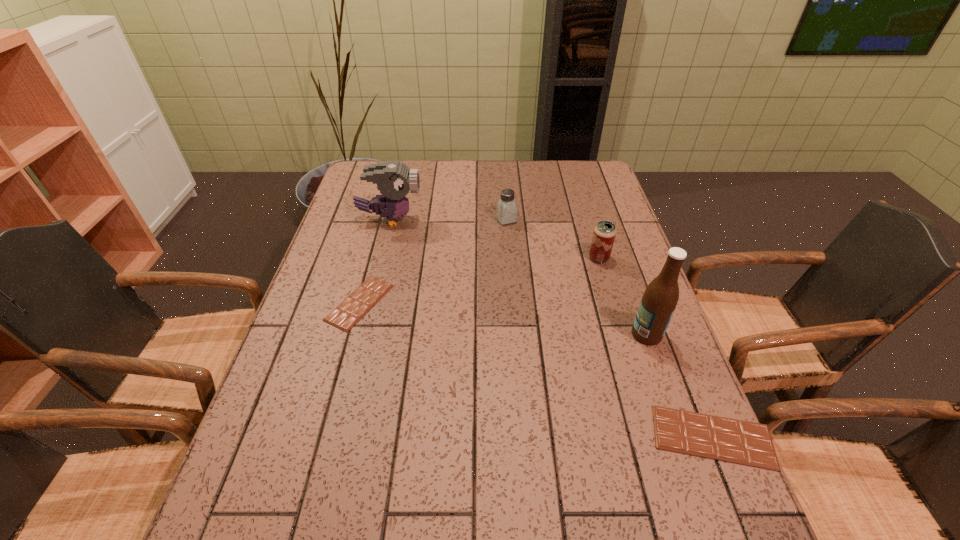
Where is `the shortest object`? This screenshot has width=960, height=540. the shortest object is located at coordinates (362, 299).

At what (x,y) coordinates should I click in order to perform the action: click on the farther chocolate bar. Please return your answer as a coordinate pair (x, y). Looking at the image, I should click on (362, 299).

Locate an element on the screen. The image size is (960, 540). the taller chocolate bar is located at coordinates (730, 440).

At what (x,y) coordinates should I click in order to perform the action: click on the right chocolate bar. Please return your answer as a coordinate pair (x, y). The height and width of the screenshot is (540, 960). Looking at the image, I should click on (730, 440).

You are a GUI agent. You are given a task and a screenshot of the screen. Output one action in this format:
    pyautogui.click(x=<x>, y=<y>)
    Task: Click on the saltshaker
    
    Given the screenshot: What is the action you would take?
    pyautogui.click(x=506, y=206)

Find the location of a particular element. the fifth shortest object is located at coordinates (394, 179).

Identify the location of the third farthest object. (604, 234).

Where is `beer bottle`? beer bottle is located at coordinates (660, 298).

Where is `vacant space situated on the back of the shorter chocolate bar`? The image size is (960, 540). vacant space situated on the back of the shorter chocolate bar is located at coordinates (388, 199).

Where is `vacant region located 0.230m on the left of the right chocolate bar`? vacant region located 0.230m on the left of the right chocolate bar is located at coordinates (537, 437).